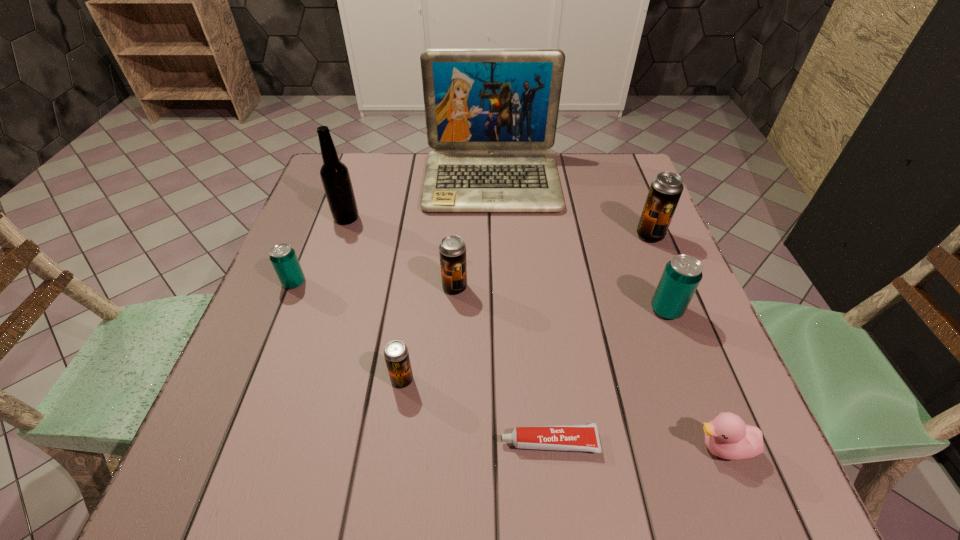
The height and width of the screenshot is (540, 960). What are the coordinates of `free space between the duckling and the fourth farthest beer can` in the screenshot? It's located at (694, 379).

At what (x,y) coordinates should I click in order to perform the action: click on empty space between the eighth tallest object and the third beer can from left to right. Please return your answer as a coordinate pair (x, y). This screenshot has width=960, height=540. Looking at the image, I should click on (588, 367).

Identify the location of object that is the fifth closest to the sixth farthest object. [x=452, y=250].

Locate which object is the eighth closest to the rightmost black beer can. Please provide its 2D coordinates. Your answer should be formatted as a tuple, i.e. [(x, y)], where the tuple contains the x and y coordinates of a point satisfying the conditions above.

[(282, 256)]

Select which beer can appears as the second closest to the seventh shortest object. Please provide its 2D coordinates. Your answer should be formatted as a tuple, i.e. [(x, y)], where the tuple contains the x and y coordinates of a point satisfying the conditions above.

[(452, 250)]

You are a GUI agent. You are given a task and a screenshot of the screen. Output one action in this format:
    pyautogui.click(x=<x>, y=<y>)
    Task: Click on the fourth closest beer can to the toothpaste
    This screenshot has width=960, height=540.
    Given the screenshot: What is the action you would take?
    pyautogui.click(x=665, y=191)

Where is `the closest black beer can to the smaller teal beer can`? the closest black beer can to the smaller teal beer can is located at coordinates (396, 354).

Select which black beer can is the second closest to the nearest beer can. Please provide its 2D coordinates. Your answer should be formatted as a tuple, i.e. [(x, y)], where the tuple contains the x and y coordinates of a point satisfying the conditions above.

[(665, 191)]

Where is `free space that satisfies the following two spatial constraints: 1. on the front side of the third tallest object; 2. on the front-facing side of the duckling`? This screenshot has width=960, height=540. free space that satisfies the following two spatial constraints: 1. on the front side of the third tallest object; 2. on the front-facing side of the duckling is located at coordinates (736, 448).